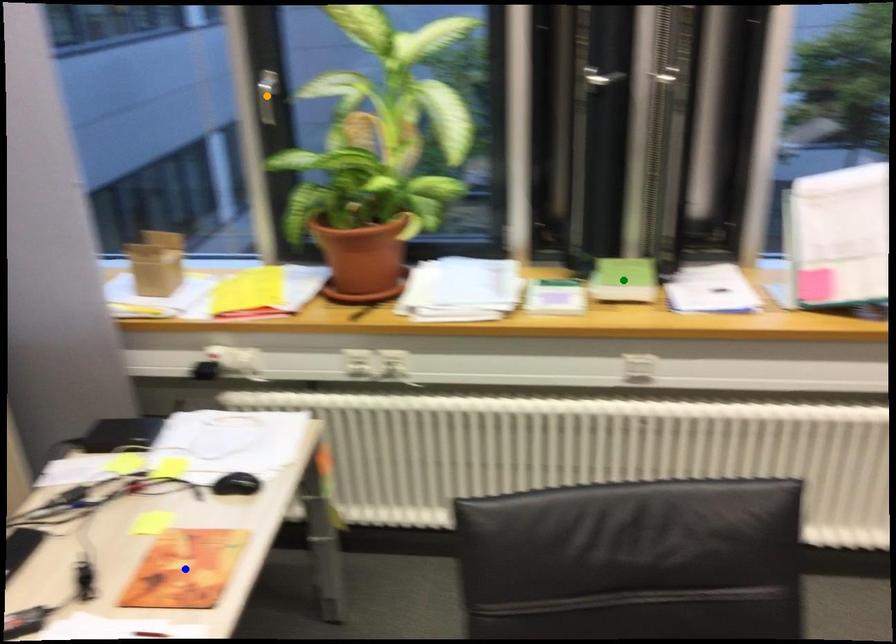
Order these from nearest to farthest:
A) blue point
B) green point
C) orange point

blue point, green point, orange point